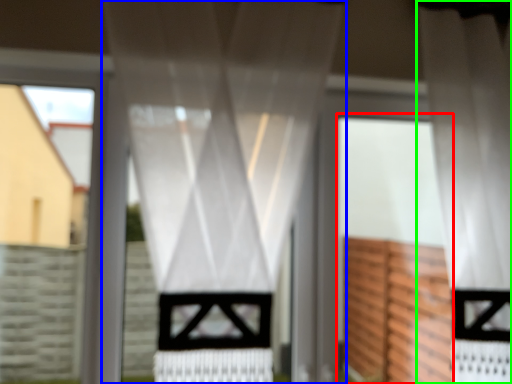
Question: Considering the real-world distances, which object is farthest from screen door (highlighted by a red box)? curtain (highlighted by a blue box) or curtain (highlighted by a green box)?

Choices:
 (A) curtain
 (B) curtain

Answer: (A)